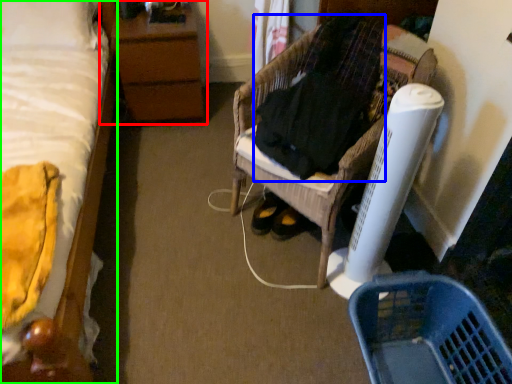
Question: Estimate the real-world distances between objects in this image. Which object is closer to nightstand (highlighted by a red box), clothing (highlighted by a blue box) or bed (highlighted by a green box)?

Choices:
 (A) clothing
 (B) bed

Answer: (B)